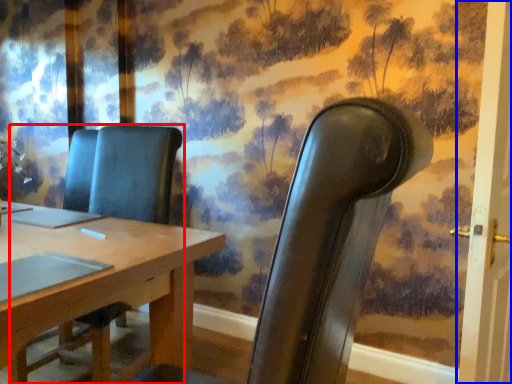
Question: Which of the following is the farthest to the observer, chair (highlighted by a red box) or door (highlighted by a blue box)?

Choices:
 (A) chair
 (B) door

Answer: (B)